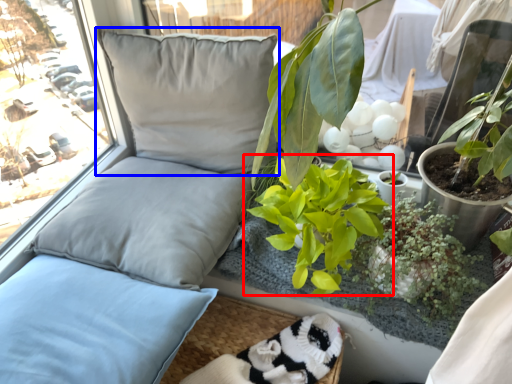
Question: Among these objects, which one is farthest to the camera, houseplant (highlighted by a red box) or pillow (highlighted by a blue box)?

Choices:
 (A) houseplant
 (B) pillow

Answer: (B)